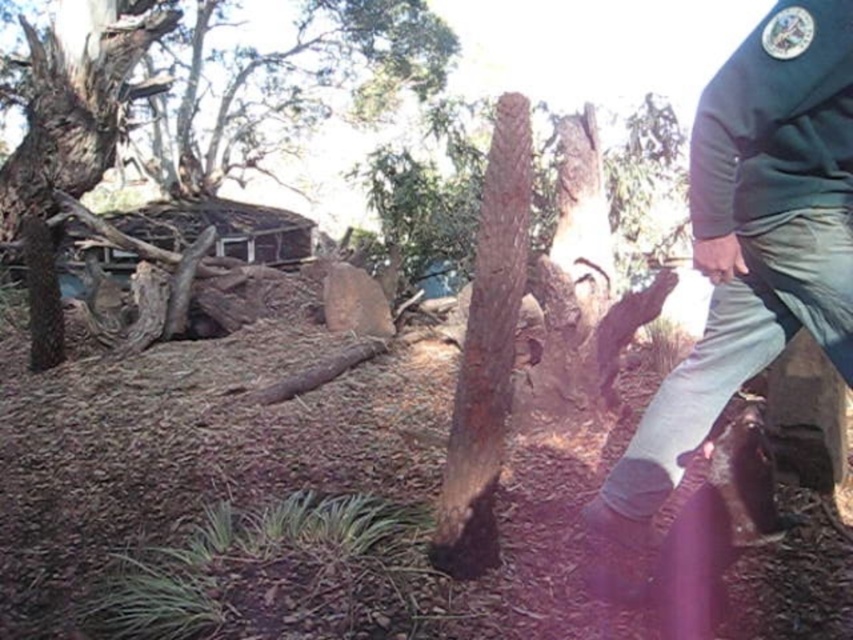
You are a hiker who wants to cross from the left side to the right side of the scene. There are two tree trunks in your path. The dark brown rough bark tree at left and the brown rough bark tree trunk at center. Which tree trunk should you avoid stepping on to ensure stability?

You should avoid stepping on the brown rough bark tree trunk at center because the dark brown rough bark tree at left is positioned over it, making the center trunk less stable.

You are standing at the tree stump in the foreground of the outdoor scene. You see two points marked in the image. Which point, point (734, 385) or point (515, 116), is closer to your current position?

Point (734, 385) is closer to your current position at the tree stump because it is in front of point (515, 116).

You are standing at the center of the image and want to move towards the dark brown rough bark tree at left. In which direction should you move?

You should move to the left because the dark brown rough bark tree at left is located at point [71,134], which is to the left side of the image.